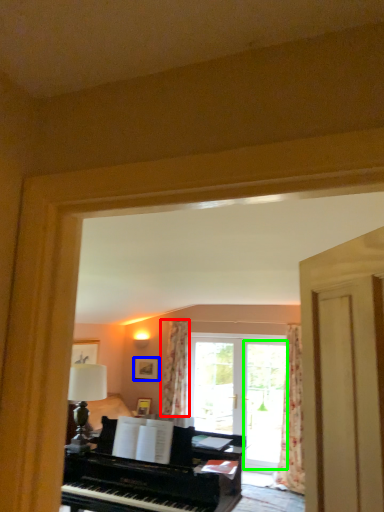
Question: Which object is the farthest from curtain (highlighted by a red box)? Choose among these: picture frame (highlighted by a blue box) or screen door (highlighted by a green box).

Choices:
 (A) picture frame
 (B) screen door

Answer: (B)